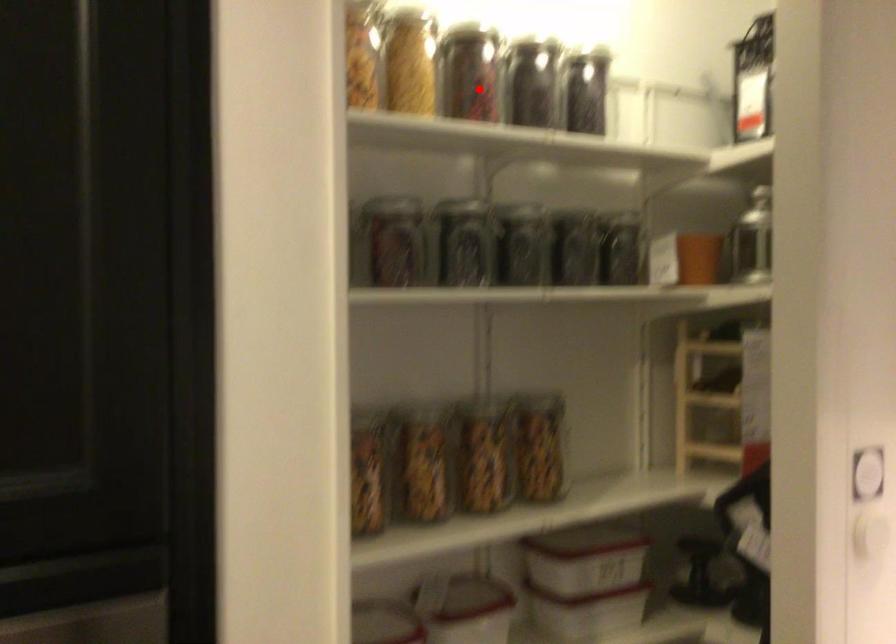
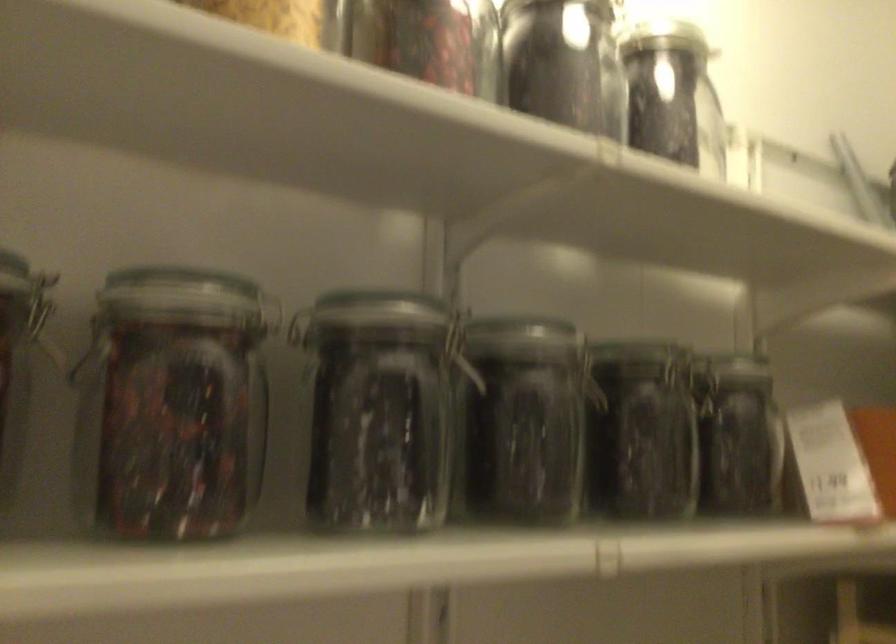
Question: I am providing you with two images of the same scene from different viewpoints. Given a red point in image1, look at the same physical point in image2. Is it:

Choices:
 (A) Closer to the viewpoint
 (B) Farther from the viewpoint

Answer: (A)